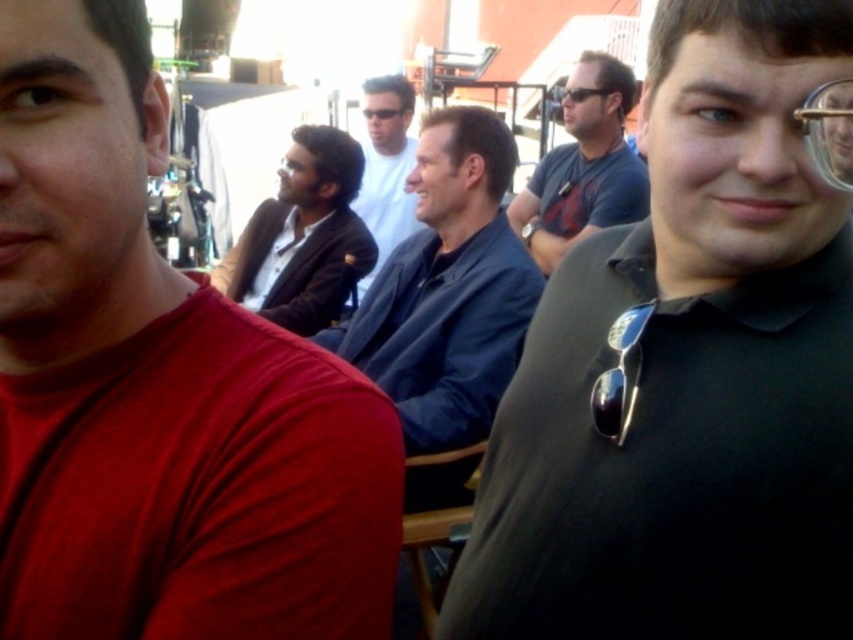
Does dark brown suit jacket at center appear over black plastic sunglasses at center?

No.

Is point (334, 188) closer to viewer compared to point (378, 120)?

That is True.

Between point (366, 259) and point (392, 116), which one is positioned behind?

Positioned behind is point (392, 116).

Identify the location of dark brown suit jacket at center. Image resolution: width=853 pixels, height=640 pixels. pos(305,236).

Can you confirm if blue fabric jacket at center is smaller than white matte shirt at center?

No, blue fabric jacket at center is not smaller than white matte shirt at center.

Who is lower down, blue fabric jacket at center or white matte shirt at center?

blue fabric jacket at center is below.

Does point (413, 365) come behind point (408, 216)?

No, (413, 365) is in front of (408, 216).

What are the coordinates of `blue fabric jacket at center` in the screenshot? It's located at pyautogui.click(x=447, y=289).

Based on the photo, can you confirm if blue fabric jacket at center is positioned below sunglasses at center?

Indeed, blue fabric jacket at center is positioned under sunglasses at center.

Who is more forward, [479,435] or [592,93]?

Point [479,435]

Image resolution: width=853 pixels, height=640 pixels. What are the coordinates of `blue fabric jacket at center` in the screenshot? It's located at (447, 289).